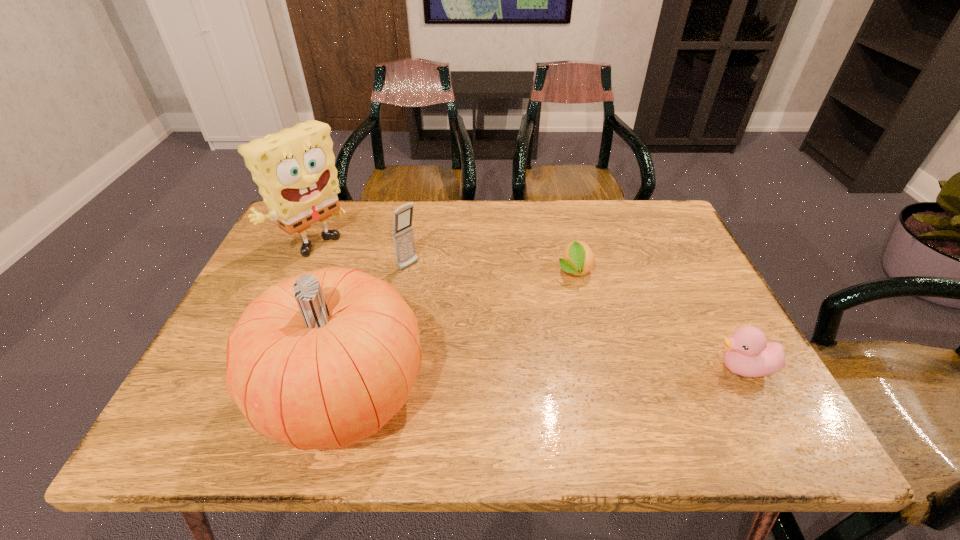
In order to click on free point located on the front-facing side of the duckling in this screenshot , I will do `click(673, 368)`.

You are a GUI agent. You are given a task and a screenshot of the screen. Output one action in this format:
    pyautogui.click(x=<x>, y=<y>)
    Task: Click on the free space located on the front-facing side of the duckling
    Image resolution: width=960 pixels, height=540 pixels.
    Given the screenshot: What is the action you would take?
    pyautogui.click(x=583, y=368)

Identify the location of vacant space located 0.360m on the front-facing side of the duckling. This screenshot has width=960, height=540. (540, 368).

The width and height of the screenshot is (960, 540). What are the coordinates of `blank area located on the front-facing side of the cellular telephone` in the screenshot? It's located at (433, 284).

Where is `free space located on the front-facing side of the cellular telephone`? Image resolution: width=960 pixels, height=540 pixels. free space located on the front-facing side of the cellular telephone is located at coordinates (473, 315).

Identify the location of free location located on the front-facing side of the cellular telephone. (492, 329).

In order to click on free space located on the face of the sponge in this screenshot , I will do `click(390, 306)`.

The width and height of the screenshot is (960, 540). I want to click on free spot located on the face of the sponge, so click(x=373, y=295).

Locate an element on the screen. free location located 0.170m on the face of the sponge is located at coordinates (375, 297).

The image size is (960, 540). What are the coordinates of `free space located 0.270m with leaves positioned above the second object from right to left` in the screenshot? It's located at (x=589, y=377).